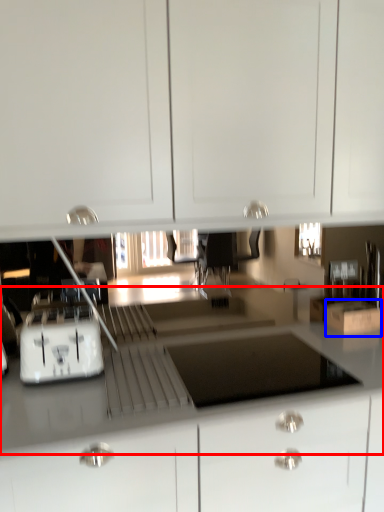
Question: Which object appears closest to the camera in this image, counter top (highlighted by a red box) or cardboard box (highlighted by a blue box)?

Choices:
 (A) counter top
 (B) cardboard box

Answer: (A)